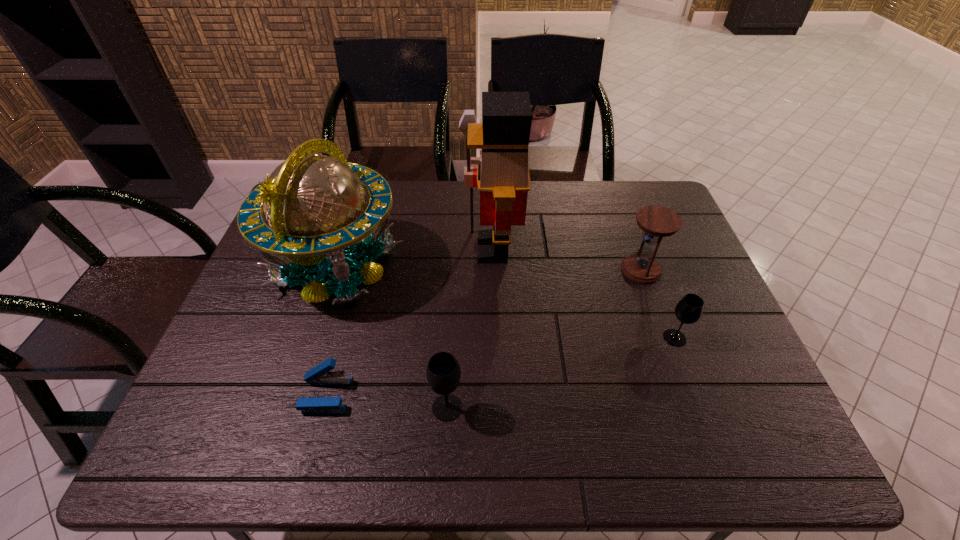
At what (x,y) coordinates should I click in order to perform the action: click on nutcracker. Please return your answer as a coordinate pair (x, y). The width and height of the screenshot is (960, 540). Looking at the image, I should click on (502, 176).

This screenshot has height=540, width=960. I want to click on globe, so click(x=316, y=205).

Find the location of a particular element. Image resolution: width=960 pixels, height=540 pixels. hourglass is located at coordinates 657,222.

Find the location of a particular element. the left wineglass is located at coordinates (443, 373).

This screenshot has width=960, height=540. I want to click on the taller wineglass, so click(x=443, y=373).

Locate an element on the screen. the fourth farthest object is located at coordinates (689, 309).

In order to click on the right wineglass in this screenshot , I will do `click(689, 309)`.

What are the coordinates of `the shortest object` in the screenshot? It's located at (321, 374).

Locate an element on the screen. Image resolution: width=960 pixels, height=540 pixels. blank space located 0.370m in front of the tallest object holding the staff is located at coordinates (338, 249).

Locate an element on the screen. The image size is (960, 540). vacant space situated in front of the tallest object holding the staff is located at coordinates (412, 249).